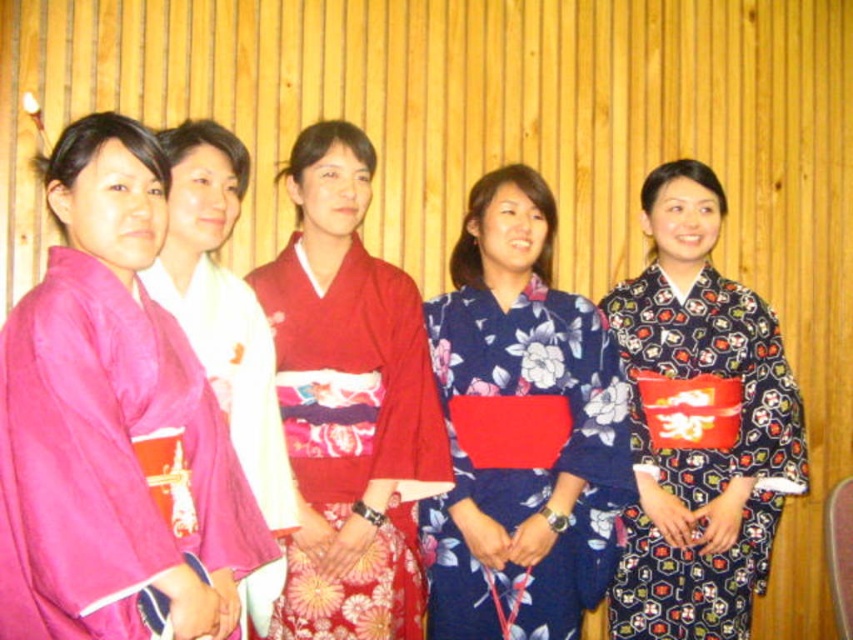
Is matte pink kimono at left positioned in front of pink silk kimono at left?

Yes, it is in front of pink silk kimono at left.

What do you see at coordinates (112, 420) in the screenshot?
I see `matte pink kimono at left` at bounding box center [112, 420].

Is point (229, 589) in front of point (225, 280)?

Yes, point (229, 589) is closer to viewer.

Locate an element on the screen. matte pink kimono at left is located at coordinates (112, 420).

Is matte pink kimono at left wider than floral kimono at center?

In fact, matte pink kimono at left might be narrower than floral kimono at center.

Who is more forward, (190, 506) or (590, 552)?

Positioned in front is point (190, 506).

Where is `matte pink kimono at left`? matte pink kimono at left is located at coordinates (112, 420).

Who is taller, floral kimono at center or floral-patterned kimono at right?

With more height is floral-patterned kimono at right.

Is floral kimono at center smaller than floral-patterned kimono at right?

Indeed, floral kimono at center has a smaller size compared to floral-patterned kimono at right.

Where is `floral kimono at center`? Image resolution: width=853 pixels, height=640 pixels. floral kimono at center is located at coordinates (521, 429).